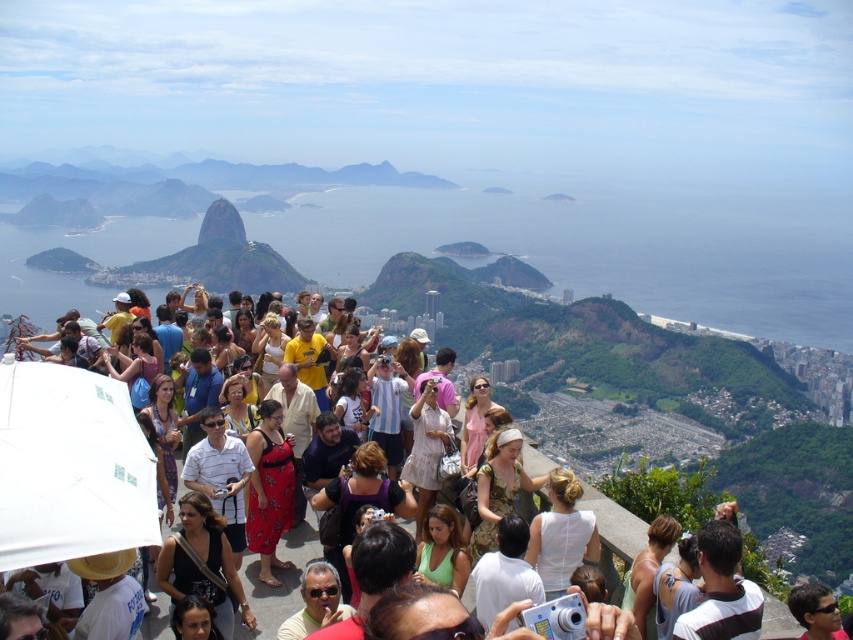
Question: Which point is farther from the camera taking this photo?

Choices:
 (A) (625, 417)
 (B) (181, 602)
 (C) (648, 608)

Answer: (A)

Question: Does matte yellow shirt at center appear on the right side of matte purple dress at center?

Choices:
 (A) no
 (B) yes

Answer: (B)

Question: Estimate the real-world distances between objects in this image. Which object is farther from the green floral dress at center?

Choices:
 (A) green matte dress at center
 (B) pink satin dress at center

Answer: (A)

Question: Can you confirm if green matte dress at center is positioned above matte purple dress at center?

Choices:
 (A) no
 (B) yes

Answer: (A)

Question: Does black leather bag at center appear on the left side of matte purple dress at center?

Choices:
 (A) yes
 (B) no

Answer: (B)

Question: Which object is the farthest from the printed cotton dress at center?

Choices:
 (A) pink satin dress at center
 (B) dark brown hair at center
 (C) green floral dress at center
 (D) white matte dress at center

Answer: (D)